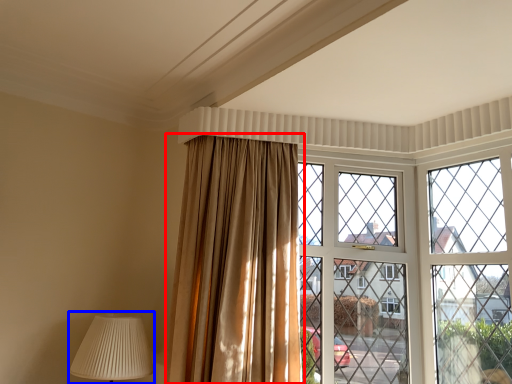
Question: Which object is closer to the camera taking this photo, curtain (highlighted by a red box) or table lamp (highlighted by a blue box)?

Choices:
 (A) curtain
 (B) table lamp

Answer: (A)